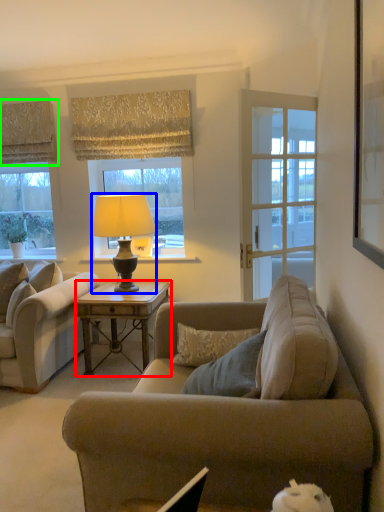
Question: Considering the real-world distances, which object is farthest from desk (highlighted by a red box)? lamp (highlighted by a blue box) or curtain (highlighted by a green box)?

Choices:
 (A) lamp
 (B) curtain

Answer: (B)